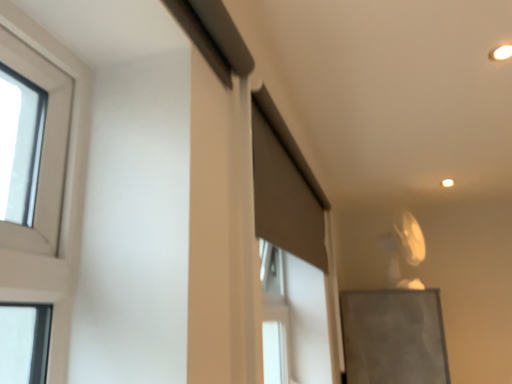
Question: Relative to matte gray screen door at upper center, is matte gray bulletin board at lower right in front or behind?

Choices:
 (A) behind
 (B) front

Answer: (A)

Question: Considering the positions of matte gray bulletin board at lower right and matte gray screen door at upper center in the image, is matte gray bulletin board at lower right wider or thinner than matte gray screen door at upper center?

Choices:
 (A) thin
 (B) wide

Answer: (B)

Question: In terms of height, does matte gray bulletin board at lower right look taller or shorter compared to matte gray screen door at upper center?

Choices:
 (A) short
 (B) tall

Answer: (B)

Question: From the image's perspective, is matte gray screen door at upper center located above or below matte gray bulletin board at lower right?

Choices:
 (A) above
 (B) below

Answer: (A)

Question: Is matte gray screen door at upper center in front of or behind matte gray bulletin board at lower right in the image?

Choices:
 (A) behind
 (B) front

Answer: (B)

Question: From a real-world perspective, relative to matte gray bulletin board at lower right, is matte gray screen door at upper center vertically above or below?

Choices:
 (A) above
 (B) below

Answer: (A)

Question: In the image, is matte gray screen door at upper center on the left side or the right side of matte gray bulletin board at lower right?

Choices:
 (A) left
 (B) right

Answer: (A)